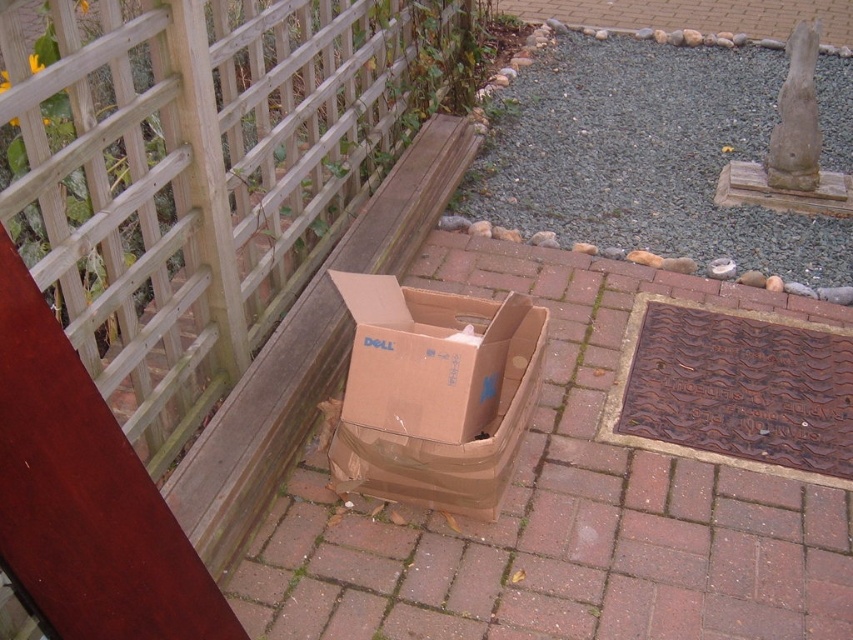
You are standing on the paved bricks and want to place a new potted plant on the ground. The wooden lattice at left is in the way. Can you move the brown cardboard box at center out of the way first?

The wooden lattice at left is above the brown cardboard box at center, so you can move the brown cardboard box at center first to access the area beneath it.

You are standing in the garden and want to place a small potted plant exactly at point (392, 76). The potted plant requires a spot that is at least 2.5 meters away from you. Can you place it there?

The distance of point (392, 76) from camera is 3.05 meters, so yes, you can place the potted plant there since it meets the required distance of at least 2.5 meters.

In the scene shown: You are standing at the center of the garden. You need to place a new decorative planter exactly where the wooden lattice at left is currently located. What are the coordinates of the spot where you should place it?

The coordinates for the wooden lattice at left are at point [199,173], so you should place the new decorative planter at those coordinates.